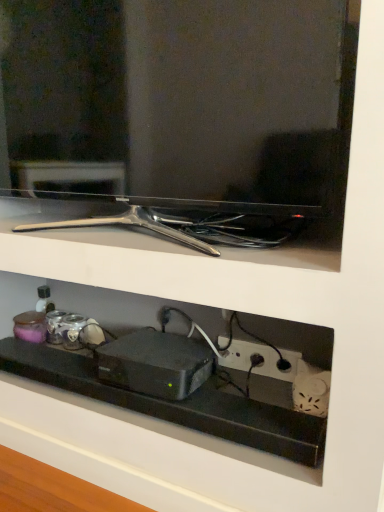
Question: From a real-world perspective, is black plastic shelf at lower center physically above black plastic power outlet at lower right?

Choices:
 (A) yes
 (B) no

Answer: (B)

Question: Is black plastic shelf at lower center wider than black plastic power outlet at lower right?

Choices:
 (A) yes
 (B) no

Answer: (A)

Question: Is black plastic shelf at lower center shorter than black plastic power outlet at lower right?

Choices:
 (A) no
 (B) yes

Answer: (B)

Question: Is black plastic shelf at lower center further to camera compared to black plastic power outlet at lower right?

Choices:
 (A) no
 (B) yes

Answer: (A)

Question: Can black plastic power outlet at lower right be found inside black plastic shelf at lower center?

Choices:
 (A) no
 (B) yes

Answer: (A)

Question: Is black plastic shelf at lower center in front of or behind black plastic power outlet at lower right in the image?

Choices:
 (A) front
 (B) behind

Answer: (A)

Question: Choose the correct answer: Is black plastic shelf at lower center inside black plastic power outlet at lower right or outside it?

Choices:
 (A) outside
 (B) inside

Answer: (A)

Question: Does point coord(34,375) appear closer or farther from the camera than point coord(269,354)?

Choices:
 (A) closer
 (B) farther

Answer: (B)

Question: Considering the positions of black plastic shelf at lower center and black plastic power outlet at lower right in the image, is black plastic shelf at lower center wider or thinner than black plastic power outlet at lower right?

Choices:
 (A) wide
 (B) thin

Answer: (A)

Question: Relative to matte black tv at upper center, is black plastic shelf at lower center in front or behind?

Choices:
 (A) behind
 (B) front

Answer: (A)

Question: From the image's perspective, is black plastic shelf at lower center above or below matte black tv at upper center?

Choices:
 (A) above
 (B) below

Answer: (B)

Question: From a real-world perspective, is black plastic shelf at lower center physically located above or below matte black tv at upper center?

Choices:
 (A) above
 (B) below

Answer: (B)

Question: In terms of height, does black plastic shelf at lower center look taller or shorter compared to matte black tv at upper center?

Choices:
 (A) short
 (B) tall

Answer: (A)

Question: Is matte black tv at upper center in front of or behind black plastic power outlet at lower right in the image?

Choices:
 (A) front
 (B) behind

Answer: (A)

Question: Considering the positions of matte black tv at upper center and black plastic power outlet at lower right in the image, is matte black tv at upper center taller or shorter than black plastic power outlet at lower right?

Choices:
 (A) tall
 (B) short

Answer: (A)